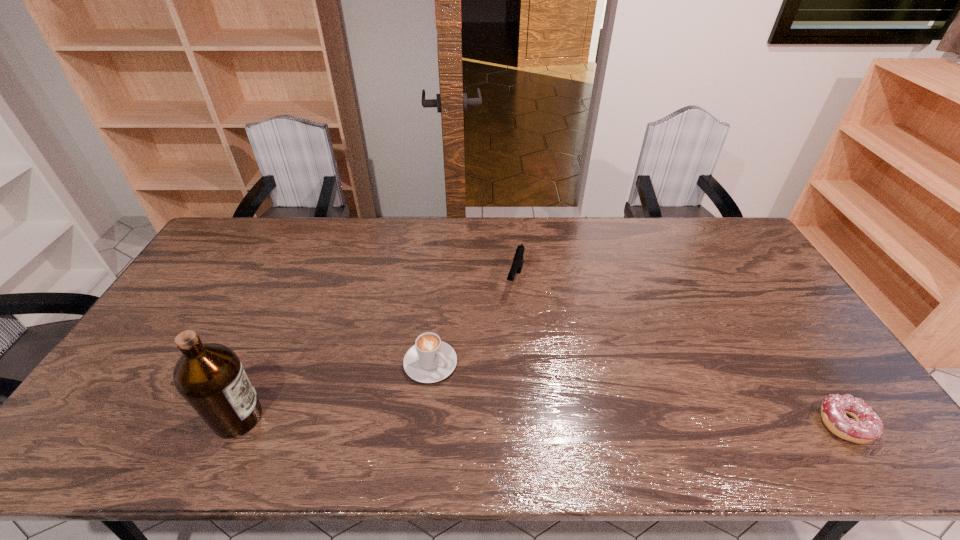
Locate an element on the screen. This screenshot has height=540, width=960. free space located to the right of the third object from right to left is located at coordinates (498, 417).

You are a GUI agent. You are given a task and a screenshot of the screen. Output one action in this format:
    pyautogui.click(x=<x>, y=<y>)
    Task: Click on the free location located 0.140m to the right of the third object from right to left
    
    Given the screenshot: What is the action you would take?
    pyautogui.click(x=490, y=409)

Locate an element on the screen. The height and width of the screenshot is (540, 960). vacant space situated to the right of the third object from right to left is located at coordinates (480, 402).

This screenshot has height=540, width=960. Identify the location of free space located on the front-facing side of the farthest object. coord(508,313).

Find the location of a particular element. This screenshot has width=960, height=540. free space located on the front-facing side of the farthest object is located at coordinates (477, 406).

Find the location of a particular element. free space located 0.200m on the front-facing side of the farthest object is located at coordinates (497, 346).

At what (x,y) coordinates should I click in order to perform the action: click on olive oil that is at the near edge. Please return your answer as a coordinate pair (x, y). This screenshot has width=960, height=540. Looking at the image, I should click on (209, 376).

Locate an element on the screen. The image size is (960, 540). doughnut that is at the near edge is located at coordinates (865, 426).

Where is `object present at the right edge`? The width and height of the screenshot is (960, 540). object present at the right edge is located at coordinates (865, 426).

Locate an element on the screen. Image resolution: width=960 pixels, height=540 pixels. object that is at the near right corner is located at coordinates (865, 426).